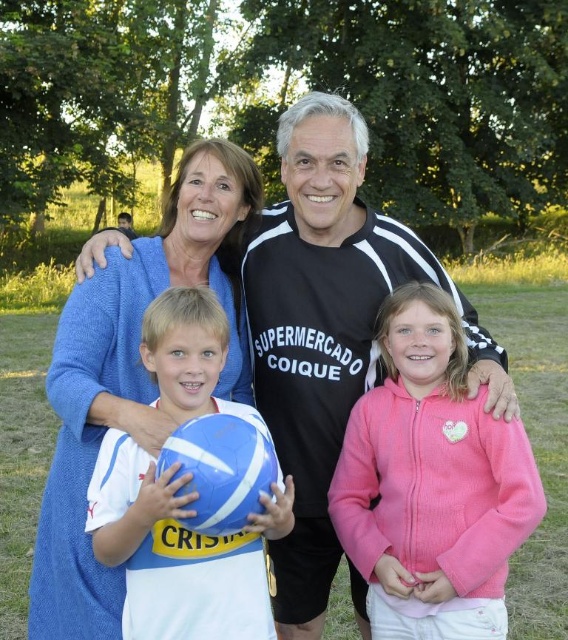
Can you confirm if pink fleece jacket at center is wider than blue wool sweater at upper left?

Incorrect, pink fleece jacket at center's width does not surpass blue wool sweater at upper left's.

Is pink fleece jacket at center bigger than blue wool sweater at upper left?

Actually, pink fleece jacket at center might be smaller than blue wool sweater at upper left.

Describe the element at coordinates (432, 483) in the screenshot. I see `pink fleece jacket at center` at that location.

Identify the location of pink fleece jacket at center. (432, 483).

Which of these two, black jersey at center or pink fleece jacket at center, stands taller?

With more height is black jersey at center.

Is black jersey at center to the left of pink fleece jacket at center from the viewer's perspective?

Correct, you'll find black jersey at center to the left of pink fleece jacket at center.

Where is `black jersey at center`? black jersey at center is located at coordinates (329, 330).

Does black jersey at center have a larger size compared to blue wool sweater at upper left?

No, black jersey at center is not bigger than blue wool sweater at upper left.

Can you confirm if black jersey at center is positioned to the left of blue wool sweater at upper left?

Incorrect, black jersey at center is not on the left side of blue wool sweater at upper left.

Which is behind, point (323, 262) or point (110, 400)?

Positioned behind is point (323, 262).

Where is `black jersey at center`? This screenshot has width=568, height=640. black jersey at center is located at coordinates (329, 330).